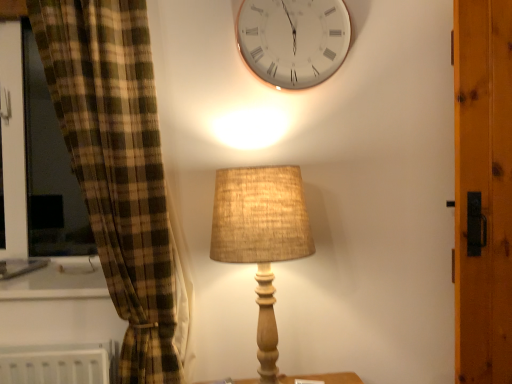
Question: Is white glossy clock at upper center wider than burlap lampshade at center?

Choices:
 (A) no
 (B) yes

Answer: (A)

Question: Does white glossy clock at upper center appear on the right side of burlap lampshade at center?

Choices:
 (A) no
 (B) yes

Answer: (B)

Question: Is white glossy clock at upper center far from burlap lampshade at center?

Choices:
 (A) yes
 (B) no

Answer: (B)

Question: Can you confirm if white glossy clock at upper center is taller than burlap lampshade at center?

Choices:
 (A) no
 (B) yes

Answer: (A)

Question: Does white glossy clock at upper center come behind burlap lampshade at center?

Choices:
 (A) yes
 (B) no

Answer: (A)

Question: Can you confirm if white glossy clock at upper center is positioned to the left of burlap lampshade at center?

Choices:
 (A) no
 (B) yes

Answer: (A)

Question: Can you confirm if burlap lampshade at center is taller than white glossy clock at upper center?

Choices:
 (A) no
 (B) yes

Answer: (B)

Question: Is burlap lampshade at center wider than white glossy clock at upper center?

Choices:
 (A) yes
 (B) no

Answer: (A)

Question: Is burlap lampshade at center further to camera compared to white glossy clock at upper center?

Choices:
 (A) yes
 (B) no

Answer: (B)

Question: Considering the relative positions of burlap lampshade at center and white glossy clock at upper center in the image provided, is burlap lampshade at center to the left of white glossy clock at upper center from the viewer's perspective?

Choices:
 (A) no
 (B) yes

Answer: (B)

Question: Considering the relative sizes of burlap lampshade at center and white glossy clock at upper center in the image provided, is burlap lampshade at center shorter than white glossy clock at upper center?

Choices:
 (A) no
 (B) yes

Answer: (A)

Question: Is burlap lampshade at center next to white glossy clock at upper center?

Choices:
 (A) yes
 (B) no

Answer: (B)

Question: Does point (275, 329) appear closer or farther from the camera than point (280, 69)?

Choices:
 (A) closer
 (B) farther

Answer: (B)